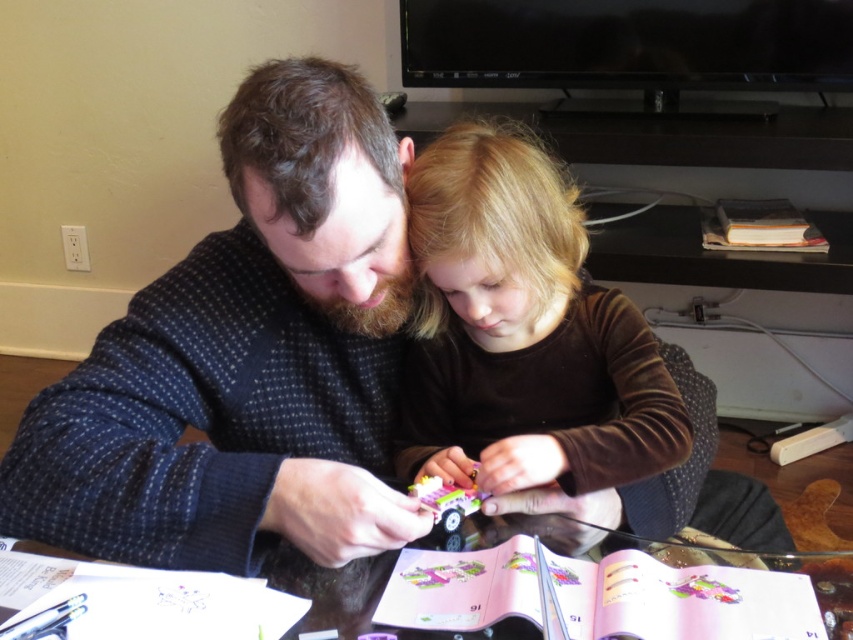
Who is higher up, dark blue textured sweater at center or hardcover book at upper right?

hardcover book at upper right is above.

Does dark blue textured sweater at center have a lesser height compared to hardcover book at upper right?

In fact, dark blue textured sweater at center may be taller than hardcover book at upper right.

In order to click on dark blue textured sweater at center in this screenshot , I will do `click(245, 358)`.

Does dark blue textured sweater at center have a greater width compared to brown velvet shirt at center?

Yes.

Is dark blue textured sweater at center to the right of brown velvet shirt at center from the viewer's perspective?

No, dark blue textured sweater at center is not to the right of brown velvet shirt at center.

Does point (364, 461) come closer to viewer compared to point (567, 346)?

No, it is behind (567, 346).

Where is `dark blue textured sweater at center`? The width and height of the screenshot is (853, 640). dark blue textured sweater at center is located at coordinates (245, 358).

Can you confirm if transparent glass table at center is wider than hardcover book at upper right?

Correct, the width of transparent glass table at center exceeds that of hardcover book at upper right.

Between transparent glass table at center and hardcover book at upper right, which one has more height?

With more height is hardcover book at upper right.

Who is more forward, (502, 554) or (798, 248)?

Point (502, 554) is more forward.

The height and width of the screenshot is (640, 853). What are the coordinates of `transparent glass table at center` in the screenshot? It's located at (680, 600).